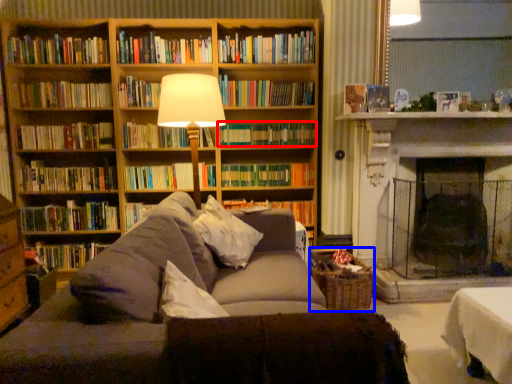
Question: Among these objects, which one is farthest to the camera, book (highlighted by a red box) or basket (highlighted by a blue box)?

Choices:
 (A) book
 (B) basket

Answer: (A)